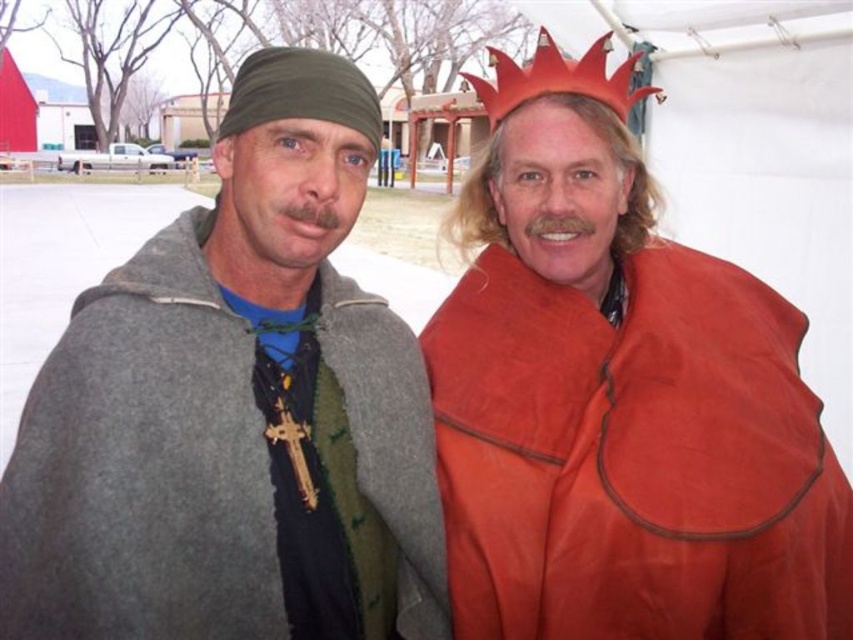
What do you see at coordinates (235, 410) in the screenshot? This screenshot has width=853, height=640. I see `gray woolen cape at left` at bounding box center [235, 410].

Between point (316, 445) and point (471, 76), which one is positioned in front?

Point (316, 445) is more forward.

Where is `gray woolen cape at left`? This screenshot has width=853, height=640. gray woolen cape at left is located at coordinates (235, 410).

Which is above, gray woolen cape at left or matte orange cape at right?

gray woolen cape at left is higher up.

Is point (415, 556) more distant than point (708, 588)?

Yes, it is behind point (708, 588).

Does point (436, 513) come farther from viewer compared to point (521, 618)?

Yes, point (436, 513) is behind point (521, 618).

Locate an element on the screen. gray woolen cape at left is located at coordinates (235, 410).

Does point (746, 285) come closer to viewer compared to point (618, 115)?

No, it is behind (618, 115).

Can you confirm if matte orange cape at right is positioned to the right of red felt crown at upper center?

Incorrect, matte orange cape at right is not on the right side of red felt crown at upper center.

The image size is (853, 640). Describe the element at coordinates (634, 458) in the screenshot. I see `matte orange cape at right` at that location.

Locate an element on the screen. The height and width of the screenshot is (640, 853). matte orange cape at right is located at coordinates (634, 458).